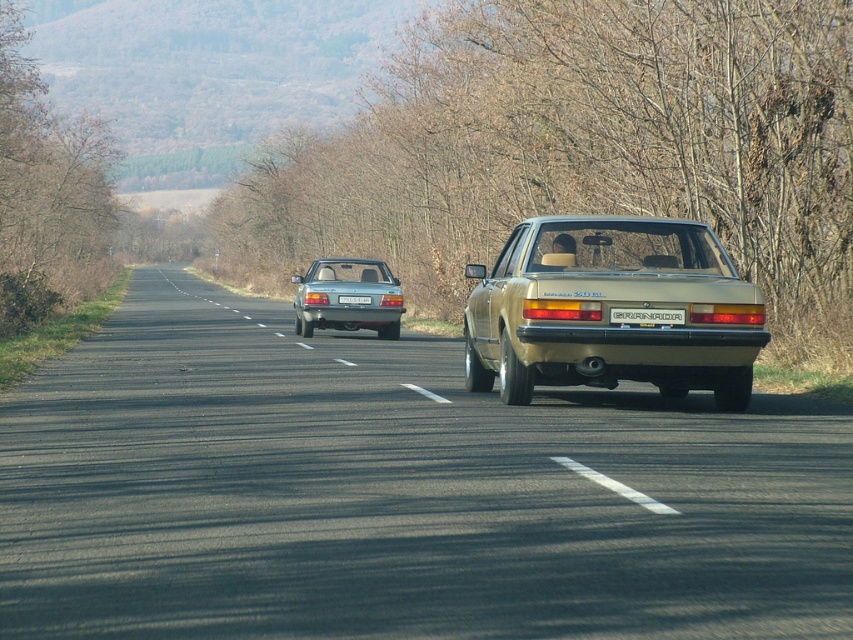
Which is in front, point (585, 241) or point (679, 320)?

Positioned in front is point (679, 320).

In the scene shown: Is gold metallic sedan at center below black plastic license plate at center?

No.

Does point (723, 260) come closer to viewer compared to point (653, 314)?

That is False.

Image resolution: width=853 pixels, height=640 pixels. I want to click on gold metallic sedan at center, so click(x=608, y=310).

Who is more forward, (569,292) or (338,298)?

Point (569,292)

Locate an element on the screen. The width and height of the screenshot is (853, 640). gold metallic sedan at center is located at coordinates point(608,310).

Locate an element on the screen. This screenshot has height=640, width=853. gold metallic sedan at center is located at coordinates (608, 310).

Between black plastic license plate at center and white plastic license plate at center, which one appears on the right side from the viewer's perspective?

black plastic license plate at center is more to the right.

Is point (666, 321) more distant than point (347, 298)?

No, it is in front of (347, 298).

Find the location of `black plastic license plate at center`. black plastic license plate at center is located at coordinates (646, 316).